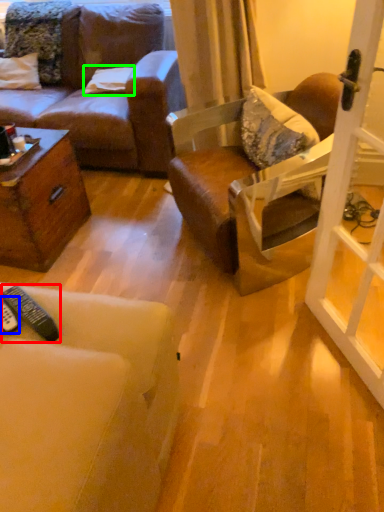
Question: Which is farther away from remote control (highlighted by a red box)? remote control (highlighted by a blue box) or pillow (highlighted by a green box)?

Choices:
 (A) remote control
 (B) pillow

Answer: (B)